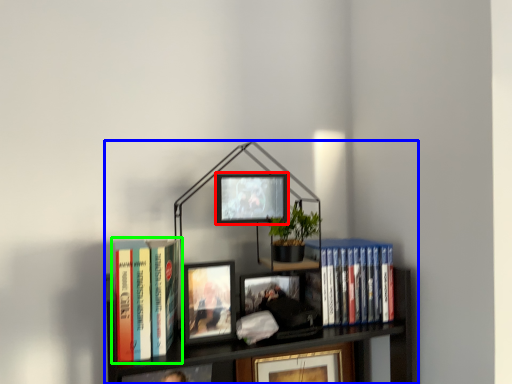
Question: Which object is positioned closest to picture frame (highlighted by a red box)? Select from bookcase (highlighted by a blue box) and book (highlighted by a green box).

Choices:
 (A) bookcase
 (B) book

Answer: (A)